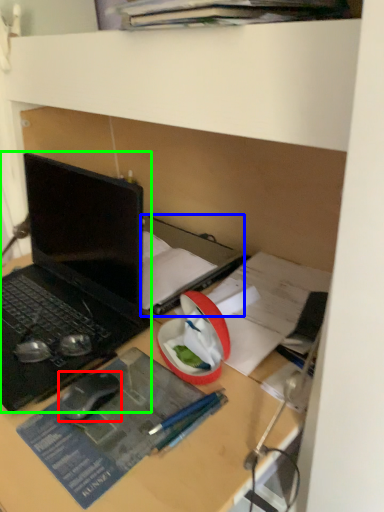
Question: Estimate the real-world distances between objects in this image. Which object is closer to mouse (highlighted by a red box), book (highlighted by a blue box) or laptop (highlighted by a green box)?

Choices:
 (A) book
 (B) laptop

Answer: (B)